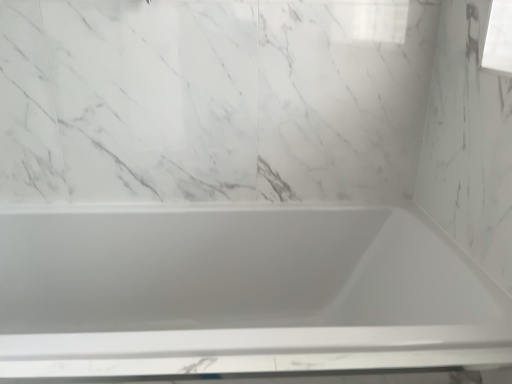
I want to click on white glossy bathtub at center, so click(x=241, y=293).

This screenshot has height=384, width=512. Describe the element at coordinates (241, 293) in the screenshot. I see `white glossy bathtub at center` at that location.

You are a GUI agent. You are given a task and a screenshot of the screen. Output one action in this format:
    pyautogui.click(x=<x>, y=<y>)
    Task: Click on the white glossy bathtub at center
    This screenshot has height=384, width=512.
    Given the screenshot: What is the action you would take?
    pyautogui.click(x=241, y=293)